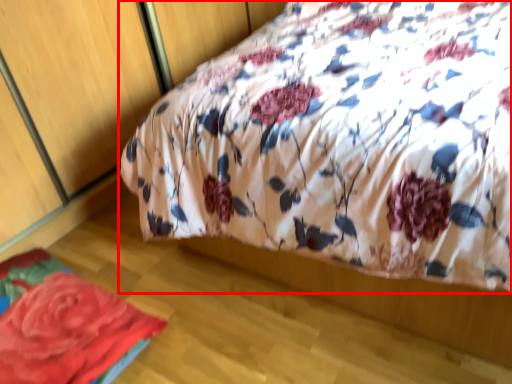
Question: From the image's perspective, what is the correct spatial positioning of bed (annotated by the red box) in reference to rose?

Choices:
 (A) below
 (B) above

Answer: (B)